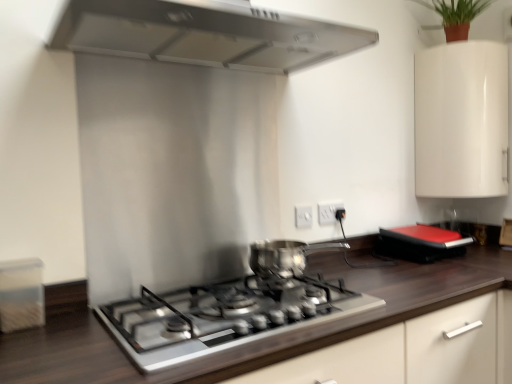
Question: Is green matte plant at upper right to the right of dark wood countertop at center from the viewer's perspective?

Choices:
 (A) no
 (B) yes

Answer: (B)

Question: Is green matte plant at upper right smaller than dark wood countertop at center?

Choices:
 (A) no
 (B) yes

Answer: (B)

Question: Is green matte plant at upper right positioned behind dark wood countertop at center?

Choices:
 (A) yes
 (B) no

Answer: (A)

Question: Is green matte plant at upper right positioned in front of dark wood countertop at center?

Choices:
 (A) yes
 (B) no

Answer: (B)

Question: Is green matte plant at upper right bigger than dark wood countertop at center?

Choices:
 (A) yes
 (B) no

Answer: (B)

Question: Considering their positions, is shiny metallic pot at center located in front of or behind satin silver gas stove at center?

Choices:
 (A) behind
 (B) front

Answer: (A)

Question: From the image's perspective, is shiny metallic pot at center located above or below satin silver gas stove at center?

Choices:
 (A) below
 (B) above

Answer: (B)

Question: Considering the positions of point (276, 261) and point (274, 294), is point (276, 261) closer or farther from the camera than point (274, 294)?

Choices:
 (A) closer
 (B) farther

Answer: (B)

Question: Considering the relative positions of shiny metallic pot at center and satin silver gas stove at center in the image provided, is shiny metallic pot at center to the left or to the right of satin silver gas stove at center?

Choices:
 (A) left
 (B) right

Answer: (B)

Question: Does point (462, 4) appear closer or farther from the camera than point (303, 221)?

Choices:
 (A) farther
 (B) closer

Answer: (A)

Question: Is green matte plant at upper right bigger or smaller than white plastic electric outlet at center, which ranks as the 1th electric outlet in front-to-back order?

Choices:
 (A) small
 (B) big

Answer: (B)

Question: Is green matte plant at upper right taller or shorter than white plastic electric outlet at center, which ranks as the 1th electric outlet in front-to-back order?

Choices:
 (A) tall
 (B) short

Answer: (A)

Question: Relative to white plastic electric outlet at center, marked as the 2th electric outlet in a right-to-left arrangement, is green matte plant at upper right in front or behind?

Choices:
 (A) behind
 (B) front

Answer: (A)

Question: From the image's perspective, is green matte plant at upper right located above or below stainless steel range hood at upper center?

Choices:
 (A) above
 (B) below

Answer: (A)

Question: Is green matte plant at upper right wider or thinner than stainless steel range hood at upper center?

Choices:
 (A) wide
 (B) thin

Answer: (B)